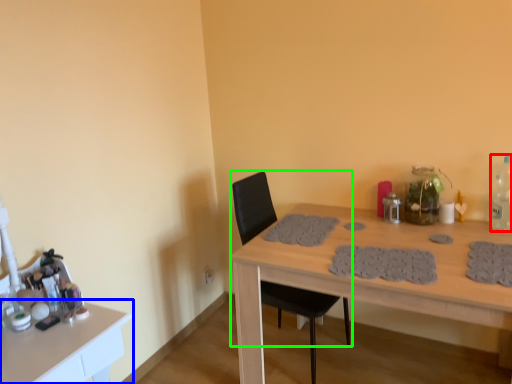
Question: Which object is the closest to the bottle (highlighted by a red box)? Choose among these: table (highlighted by a blue box) or chair (highlighted by a green box).

Choices:
 (A) table
 (B) chair

Answer: (B)